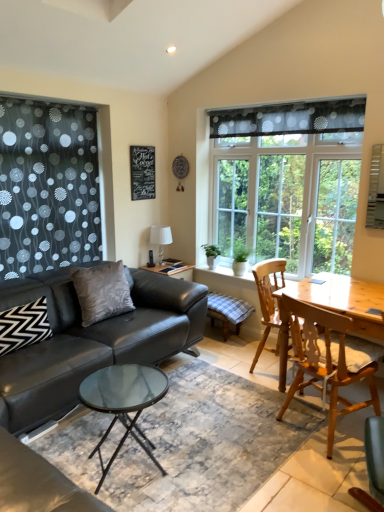
What do you see at coordinates (24, 325) in the screenshot? I see `black zigzag-patterned pillow at lower left, positioned as the 1th pillow in left-to-right order` at bounding box center [24, 325].

This screenshot has width=384, height=512. Find the location of `satin gray pillow at center, which is the second pillow from left to right`. satin gray pillow at center, which is the second pillow from left to right is located at coordinates (102, 292).

Find the location of a particular element. The width and height of the screenshot is (384, 512). matte black chair at lower right, the first chair in the front-to-back sequence is located at coordinates (373, 465).

Describe the element at coordinates (329, 359) in the screenshot. I see `light brown wooden chair at right, which ranks as the 2th chair in front-to-back order` at that location.

What do you see at coordinates (290, 118) in the screenshot? The width and height of the screenshot is (384, 512). I see `translucent polka dot curtain at upper center` at bounding box center [290, 118].

Identify the location of black zigzag-patterned pillow at lower left, acting as the 2th pillow starting from the right. (24, 325).

Where is `lamp located behind the chalkboard at upper center`? This screenshot has width=384, height=512. lamp located behind the chalkboard at upper center is located at coordinates (160, 239).

Considering the sizes of objects white glossy lampshade at upper center and chalkboard at upper center in the image provided, who is smaller, white glossy lampshade at upper center or chalkboard at upper center?

Smaller between the two is chalkboard at upper center.

From a real-world perspective, is white glossy lampshade at upper center positioned above or below chalkboard at upper center?

Clearly, from a real-world perspective, white glossy lampshade at upper center is below chalkboard at upper center.

In the image, is white glossy lampshade at upper center positioned in front of or behind chalkboard at upper center?

Visually, white glossy lampshade at upper center is located behind chalkboard at upper center.

Can you confirm if light brown wooden chair at right, the 2th chair positioned from the back, is smaller than clear glass window at center?

Yes, light brown wooden chair at right, the 2th chair positioned from the back, is smaller than clear glass window at center.

From the picture: From a real-world perspective, is light brown wooden chair at right, the 2th chair positioned from the back, located higher than clear glass window at center?

Incorrect, from a real-world perspective, light brown wooden chair at right, the 2th chair positioned from the back, is lower than clear glass window at center.

Between light brown wooden chair at right, the 2th chair positioned from the back, and clear glass window at center, which one is positioned in front?

light brown wooden chair at right, the 2th chair positioned from the back, is more forward.

From the clear glass window at center, count 2nd chair to the right and point to it. Please provide its 2D coordinates.

[(329, 359)]

Does satin gray pillow at center, which is the second pillow from left to right, have a greater width compared to wooden chair at right, acting as the 1th chair starting from the back?

In fact, satin gray pillow at center, which is the second pillow from left to right, might be narrower than wooden chair at right, acting as the 1th chair starting from the back.

Which is more to the left, satin gray pillow at center, which is the first pillow from right to left, or wooden chair at right, placed as the 3th chair when sorted from front to back?

satin gray pillow at center, which is the first pillow from right to left, is more to the left.

From a real-world perspective, is satin gray pillow at center, marked as the second pillow in a front-to-back arrangement, physically located above or below wooden chair at right, placed as the 3th chair when sorted from front to back?

satin gray pillow at center, marked as the second pillow in a front-to-back arrangement, is above wooden chair at right, placed as the 3th chair when sorted from front to back.

From a real-world perspective, is clear glass window at center on top of chalkboard at upper center?

No, from a real-world perspective, clear glass window at center is not above chalkboard at upper center.

Considering the points (223, 209) and (139, 166), which point is in front, point (223, 209) or point (139, 166)?

The point (139, 166) is closer to the camera.

From the picture: Is clear glass window at center located outside chalkboard at upper center?

That's correct, clear glass window at center is outside of chalkboard at upper center.

Which of these two, translucent polka dot curtain at upper center or black zigzag-patterned pillow at lower left, acting as the 2th pillow starting from the right, is wider?

With larger width is black zigzag-patterned pillow at lower left, acting as the 2th pillow starting from the right.

Is translucent polka dot curtain at upper center spatially inside black zigzag-patterned pillow at lower left, marked as the first pillow in a front-to-back arrangement, or outside of it?

translucent polka dot curtain at upper center is outside black zigzag-patterned pillow at lower left, marked as the first pillow in a front-to-back arrangement.

Based on the photo, does translucent polka dot curtain at upper center turn towards black zigzag-patterned pillow at lower left, positioned as the 1th pillow in left-to-right order?

No, translucent polka dot curtain at upper center is not facing towards black zigzag-patterned pillow at lower left, positioned as the 1th pillow in left-to-right order.

Which of these two, translucent polka dot curtain at upper center or black zigzag-patterned pillow at lower left, marked as the first pillow in a front-to-back arrangement, is smaller?

With smaller size is black zigzag-patterned pillow at lower left, marked as the first pillow in a front-to-back arrangement.

Considering the positions of point (20, 335) and point (260, 273), is point (20, 335) closer or farther from the camera than point (260, 273)?

Clearly, point (20, 335) is closer to the camera than point (260, 273).

Considering the sizes of objects black zigzag-patterned pillow at lower left, acting as the 2th pillow starting from the right, and wooden chair at right, acting as the 1th chair starting from the back, in the image provided, who is wider, black zigzag-patterned pillow at lower left, acting as the 2th pillow starting from the right, or wooden chair at right, acting as the 1th chair starting from the back,?

wooden chair at right, acting as the 1th chair starting from the back, is wider.

Looking at this image, from a real-world perspective, between black zigzag-patterned pillow at lower left, marked as the first pillow in a front-to-back arrangement, and wooden chair at right, acting as the 1th chair starting from the back, who is vertically lower?

From a 3D spatial view, wooden chair at right, acting as the 1th chair starting from the back, is below.

From the image's perspective, is clear glass window at center above or below matte black chair at lower right, the first chair in the front-to-back sequence?

From the image's perspective, clear glass window at center appears above matte black chair at lower right, the first chair in the front-to-back sequence.

Is clear glass window at center touching matte black chair at lower right, the first chair in the front-to-back sequence?

No.

What's the angular difference between clear glass window at center and matte black chair at lower right, which is the 3th chair in back-to-front order,'s facing directions?

The angle between the facing direction of clear glass window at center and the facing direction of matte black chair at lower right, which is the 3th chair in back-to-front order, is 68.7 degrees.

From the clear glass window at center, count 1st chair to the right and point to it. Please provide its 2D coordinates.

[(373, 465)]

At what (x,y) coordinates should I click in order to perform the action: click on lamp below the chalkboard at upper center (from a real-world perspective). Please return your answer as a coordinate pair (x, y). This screenshot has height=512, width=384. Looking at the image, I should click on (160, 239).

Identify the location of window above the light brown wooden chair at right, which ranks as the 2th chair in front-to-back order (from a real-world perspective). The height and width of the screenshot is (512, 384). (287, 198).

Based on the photo, considering their positions, is light brown wooden chair at right, which ranks as the 2th chair in front-to-back order, positioned closer to chalkboard at upper center than black zigzag-patterned pillow at lower left, acting as the 2th pillow starting from the right?

Based on the image, black zigzag-patterned pillow at lower left, acting as the 2th pillow starting from the right, appears to be nearer to chalkboard at upper center.

In the scene shown: Estimate the real-world distances between objects in this image. Which object is further from light brown wooden chair at right, the 2th chair positioned from the back, translucent polka dot curtain at upper center or wooden chair at right, placed as the 3th chair when sorted from front to back?

Based on the image, translucent polka dot curtain at upper center appears to be further to light brown wooden chair at right, the 2th chair positioned from the back.

Looking at this image, considering their positions, is black zigzag-patterned pillow at lower left, positioned as the 1th pillow in left-to-right order, positioned closer to white glossy lampshade at upper center than satin gray pillow at center, marked as the second pillow in a front-to-back arrangement?

satin gray pillow at center, marked as the second pillow in a front-to-back arrangement.

Which object lies nearer to the anchor point wooden chair at right, placed as the 3th chair when sorted from front to back, clear glass window at center or black zigzag-patterned pillow at lower left, positioned as the 1th pillow in left-to-right order?

clear glass window at center.

When comparing their distances from clear glass window at center, does black zigzag-patterned pillow at lower left, the second pillow from the back, or chalkboard at upper center seem further?

Based on the image, black zigzag-patterned pillow at lower left, the second pillow from the back, appears to be further to clear glass window at center.

Estimate the real-world distances between objects in this image. Which object is closer to white glossy lampshade at upper center, clear glass window at center or chalkboard at upper center?

The object closer to white glossy lampshade at upper center is chalkboard at upper center.

Estimate the real-world distances between objects in this image. Which object is closer to black zigzag-patterned pillow at lower left, marked as the first pillow in a front-to-back arrangement, translucent polka dot curtain at upper center or satin gray pillow at center, which is counted as the first pillow, starting from the back?

satin gray pillow at center, which is counted as the first pillow, starting from the back, is positioned closer to the anchor black zigzag-patterned pillow at lower left, marked as the first pillow in a front-to-back arrangement.

Which object lies nearer to the anchor point clear glass window at center, chalkboard at upper center or light brown wooden chair at right, which ranks as the 2th chair in front-to-back order?

chalkboard at upper center is closer to clear glass window at center.

Find the location of a particular element. The height and width of the screenshot is (512, 384). curtain between matte black chair at lower right, which is the 3th chair in back-to-front order, and white glossy lampshade at upper center in the front-back direction is located at coordinates (290, 118).

The width and height of the screenshot is (384, 512). Find the location of `window between translucent polka dot curtain at upper center and matte black chair at lower right, the first chair in the front-to-back sequence, from top to bottom`. window between translucent polka dot curtain at upper center and matte black chair at lower right, the first chair in the front-to-back sequence, from top to bottom is located at coordinates (287, 198).

Identify the location of window between wooden chair at right, placed as the 3th chair when sorted from front to back, and white glossy lampshade at upper center in the front-back direction. The width and height of the screenshot is (384, 512). (287, 198).

Identify the location of chair between chalkboard at upper center and clear glass window at center from left to right. This screenshot has height=512, width=384. (268, 298).